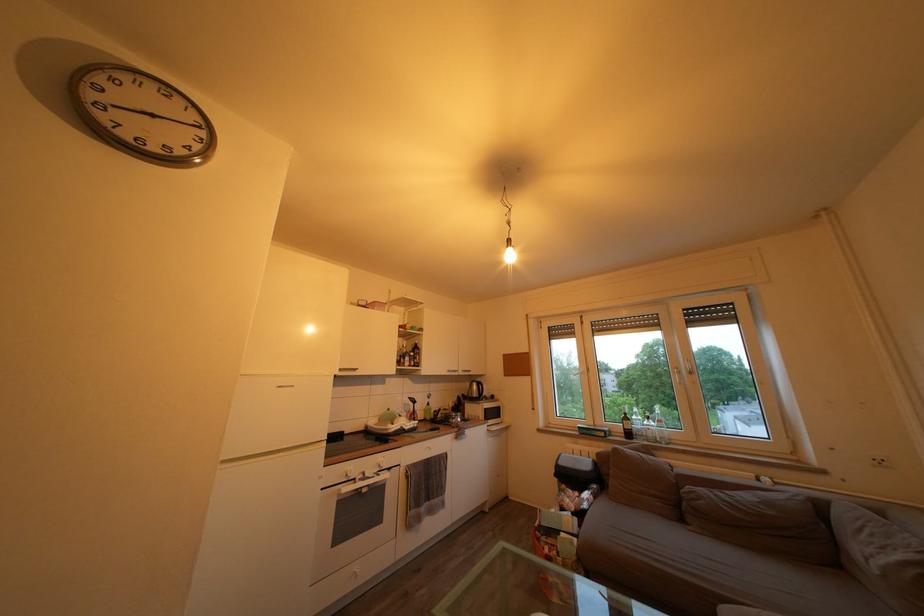
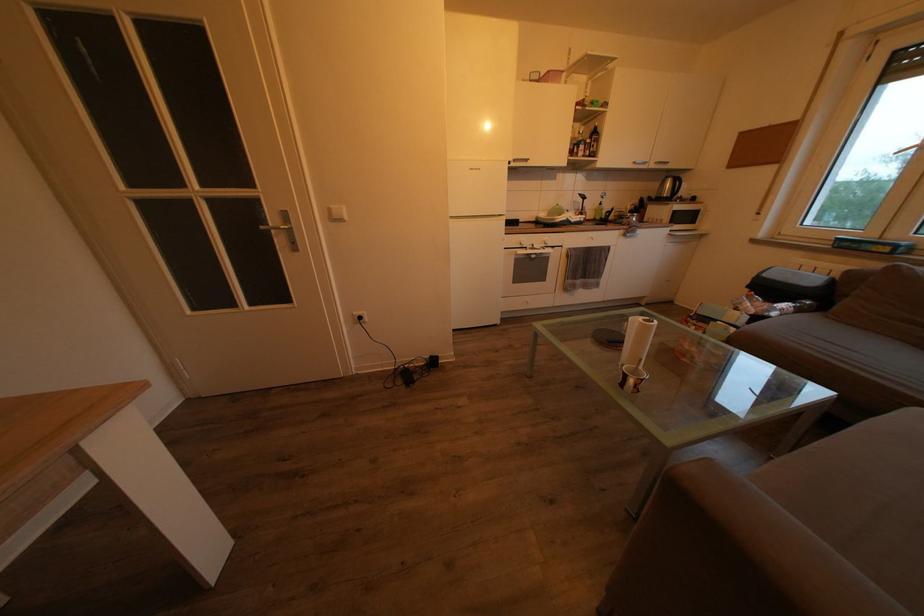
First-person continuous shooting, in which direction is the camera rotating?

The rotation direction of the camera is left-down.